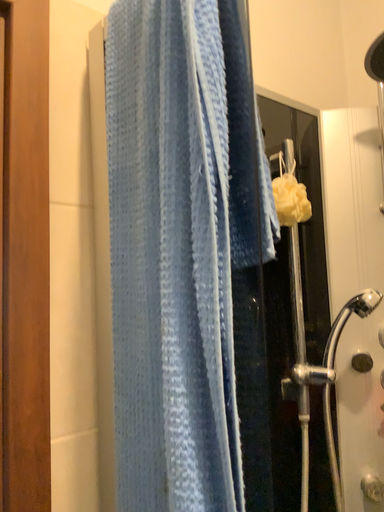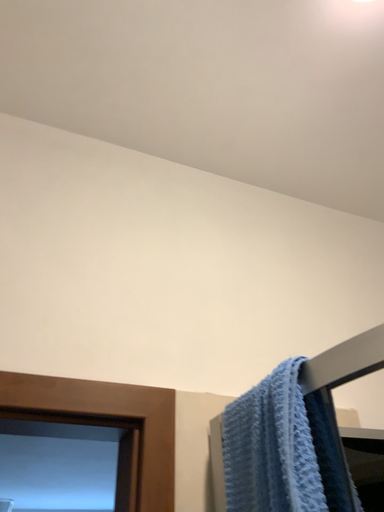
Question: How did the camera likely rotate when shooting the video?

Choices:
 (A) rotated right
 (B) rotated left

Answer: (B)